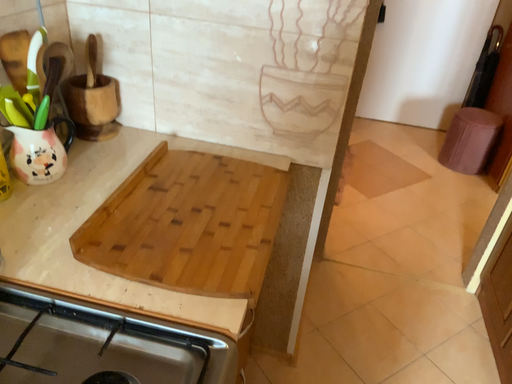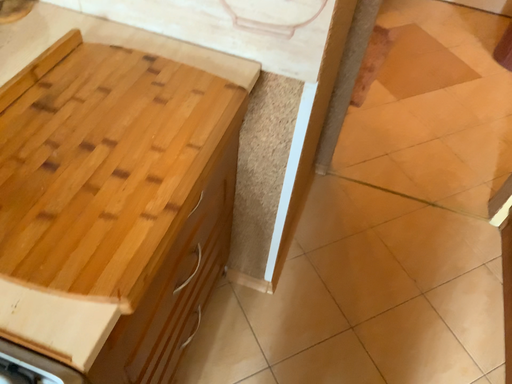
Question: Which way did the camera rotate in the video?

Choices:
 (A) rotated upward
 (B) rotated downward

Answer: (B)